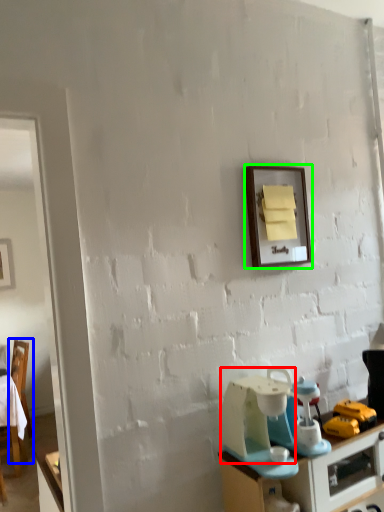
Question: Which object is the closest to the appliance (highlighted by a red box)? Choose among these: chair (highlighted by a blue box) or picture frame (highlighted by a green box).

Choices:
 (A) chair
 (B) picture frame

Answer: (B)